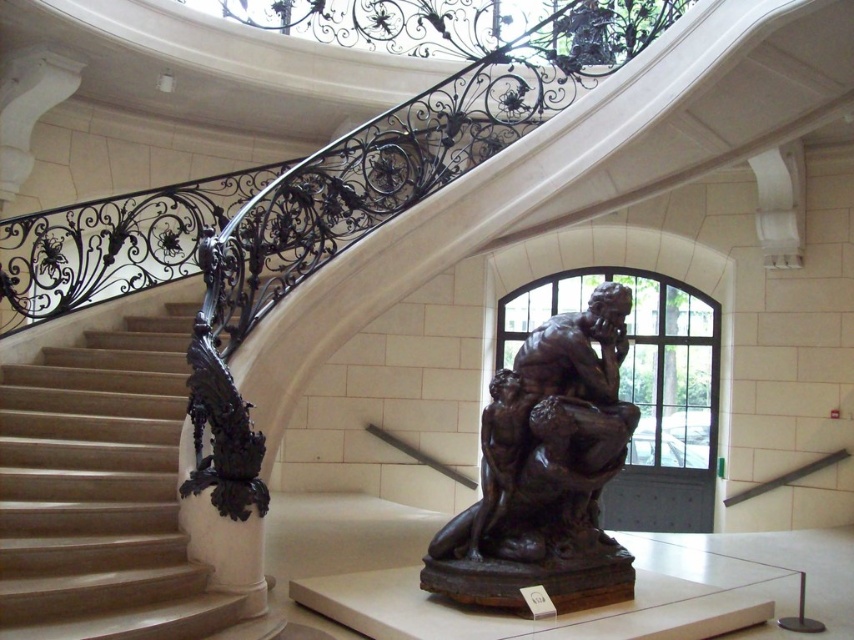
Question: Is polished wood stairs at left smaller than bronze sculpture at center?

Choices:
 (A) no
 (B) yes

Answer: (A)

Question: Can you confirm if polished wood stairs at left is positioned to the left of bronze sculpture at center?

Choices:
 (A) yes
 (B) no

Answer: (A)

Question: Which point is farther to the camera?

Choices:
 (A) (513, 400)
 (B) (185, 321)

Answer: (B)

Question: In this image, where is polished wood stairs at left located relative to bronze sculpture at center?

Choices:
 (A) left
 (B) right

Answer: (A)